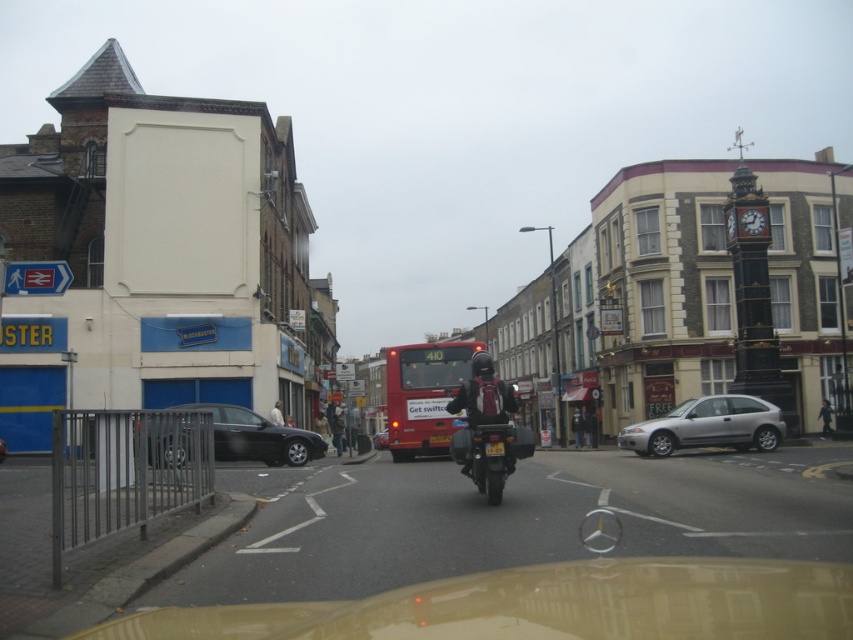
From the picture: You are standing at the center of the street and want to locate the gold metallic car at lower center. According to the coordinates provided, in which direction should you look to find it?

The gold metallic car at lower center is located at coordinates point [546,605]. Since the coordinate system places the origin at the bottom left corner, looking towards the lower center direction would help locate it.